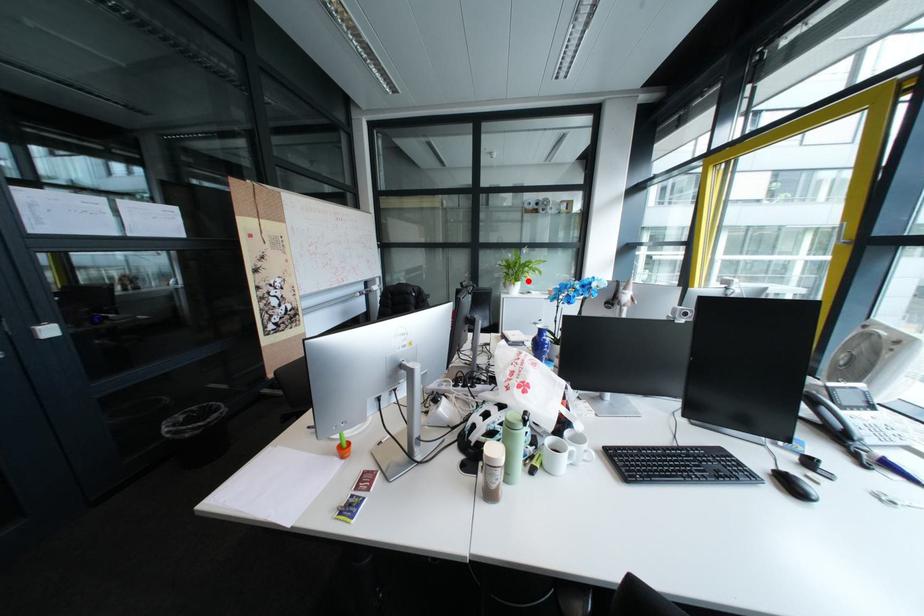
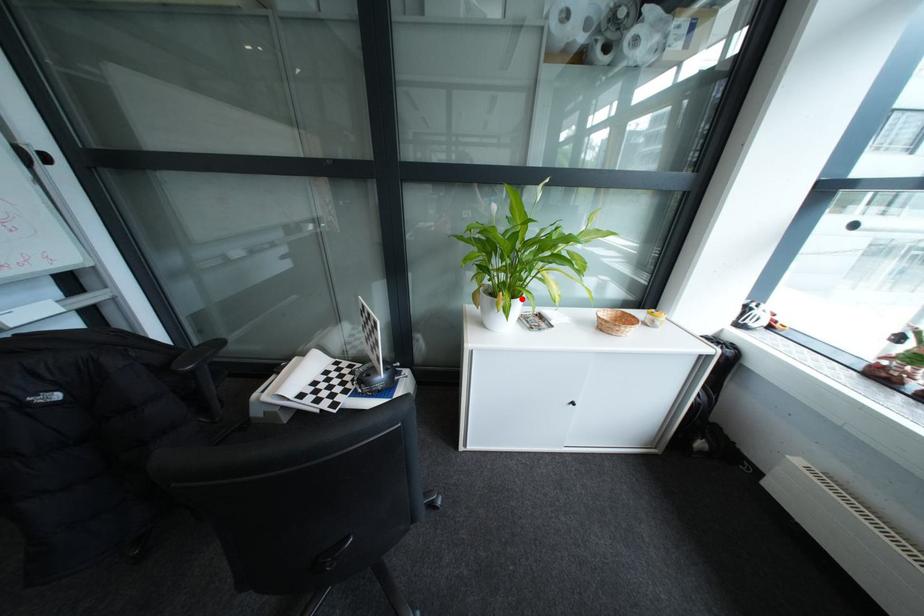
I am providing you with two images of the same scene from different viewpoints. A red point is marked on the first image and another point is marked on the second image. Do the highlighted points in image1 and image2 indicate the same real-world spot?

Yes